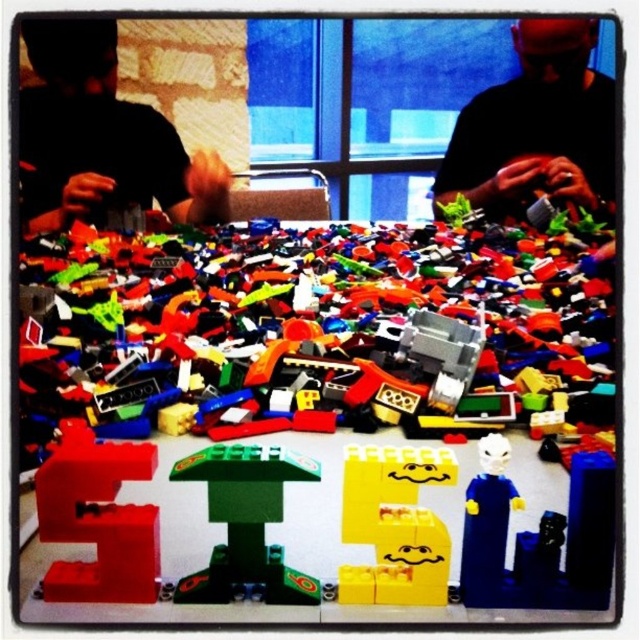
Does point (48, 513) lie in front of point (508, 483)?

No.

Does point (49, 572) lie behind point (465, 554)?

Yes.

The image size is (640, 640). I want to click on rubber red letter s at center, so click(x=97, y=518).

Does brick-like plastic blocks at center have a smaller size compared to rubber red letter s at center?

No.

Does point (152, 540) come in front of point (132, 564)?

That is True.

Where is `brick-like plastic blocks at center`? The height and width of the screenshot is (640, 640). brick-like plastic blocks at center is located at coordinates (310, 420).

Between matte black shirt at upper center and rubber red letter s at center, which one has more height?

Standing taller between the two is matte black shirt at upper center.

Can you confirm if matte black shirt at upper center is wider than rubber red letter s at center?

Yes, matte black shirt at upper center is wider than rubber red letter s at center.

Does point (525, 90) come in front of point (124, 541)?

No, (525, 90) is behind (124, 541).

Locate an element on the screen. The image size is (640, 640). matte black shirt at upper center is located at coordinates (536, 125).